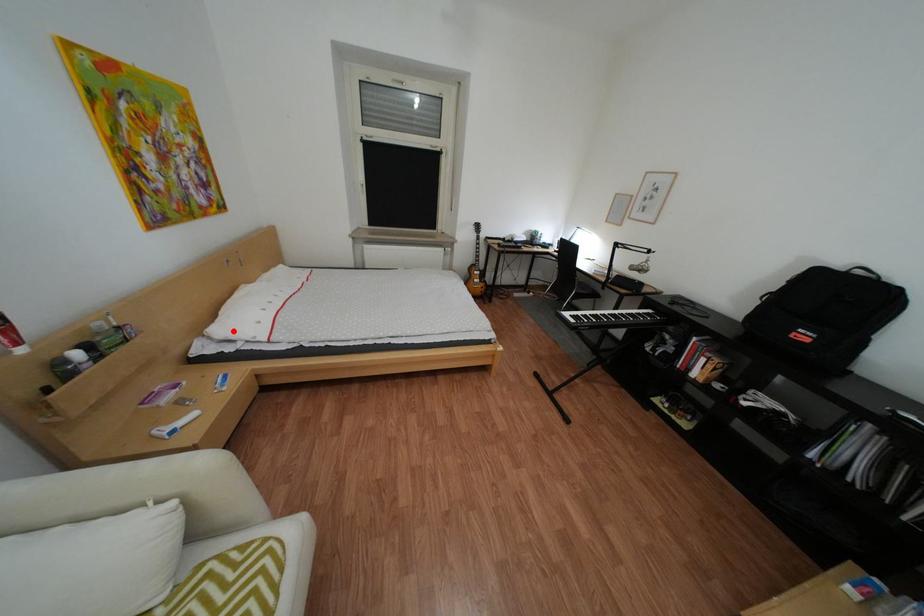
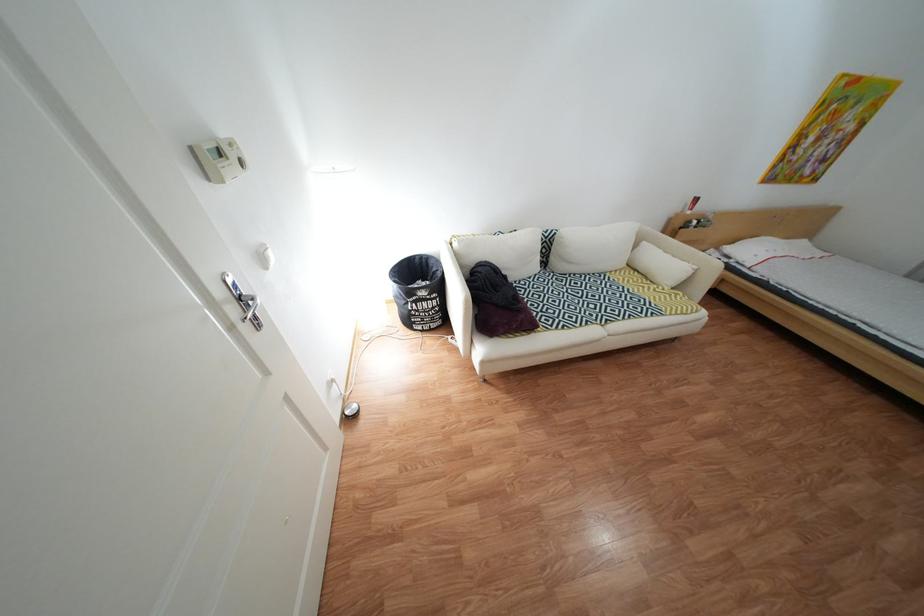
Locate, in the second image, the point that corresponds to the highlighted location in the first image.

(744, 249)